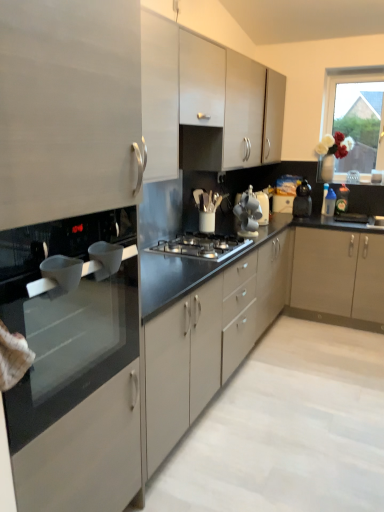
Question: Can you confirm if black matte countertop at center, which ranks as the first countertop in back-to-front order, is wider than stainless steel gas stove at center?

Choices:
 (A) no
 (B) yes

Answer: (B)

Question: From a real-world perspective, is black matte countertop at center, which ranks as the first countertop in back-to-front order, on top of stainless steel gas stove at center?

Choices:
 (A) yes
 (B) no

Answer: (B)

Question: Does black matte countertop at center, which ranks as the 2th countertop in front-to-back order, have a larger size compared to stainless steel gas stove at center?

Choices:
 (A) no
 (B) yes

Answer: (B)

Question: Does black matte countertop at center, which ranks as the 2th countertop in front-to-back order, have a smaller size compared to stainless steel gas stove at center?

Choices:
 (A) no
 (B) yes

Answer: (A)

Question: Considering the relative positions of black matte countertop at center, which ranks as the first countertop in back-to-front order, and stainless steel gas stove at center in the image provided, is black matte countertop at center, which ranks as the first countertop in back-to-front order, behind stainless steel gas stove at center?

Choices:
 (A) no
 (B) yes

Answer: (A)

Question: From a real-world perspective, is black matte countertop at center, which ranks as the first countertop in back-to-front order, below stainless steel gas stove at center?

Choices:
 (A) yes
 (B) no

Answer: (A)

Question: Would you consider stainless steel gas stove at center to be distant from white glass vase at upper right?

Choices:
 (A) no
 (B) yes

Answer: (B)

Question: Considering the relative sizes of stainless steel gas stove at center and white glass vase at upper right in the image provided, is stainless steel gas stove at center shorter than white glass vase at upper right?

Choices:
 (A) yes
 (B) no

Answer: (A)

Question: Does stainless steel gas stove at center lie behind white glass vase at upper right?

Choices:
 (A) yes
 (B) no

Answer: (B)

Question: Is stainless steel gas stove at center positioned with its back to white glass vase at upper right?

Choices:
 (A) yes
 (B) no

Answer: (B)

Question: Is stainless steel gas stove at center located outside white glass vase at upper right?

Choices:
 (A) yes
 (B) no

Answer: (A)

Question: Does stainless steel gas stove at center have a larger size compared to white glass vase at upper right?

Choices:
 (A) no
 (B) yes

Answer: (A)

Question: Can you confirm if black plastic kettle at right is positioned to the left of white ceramic cups at center, which is the second appliance in back-to-front order?

Choices:
 (A) no
 (B) yes

Answer: (A)